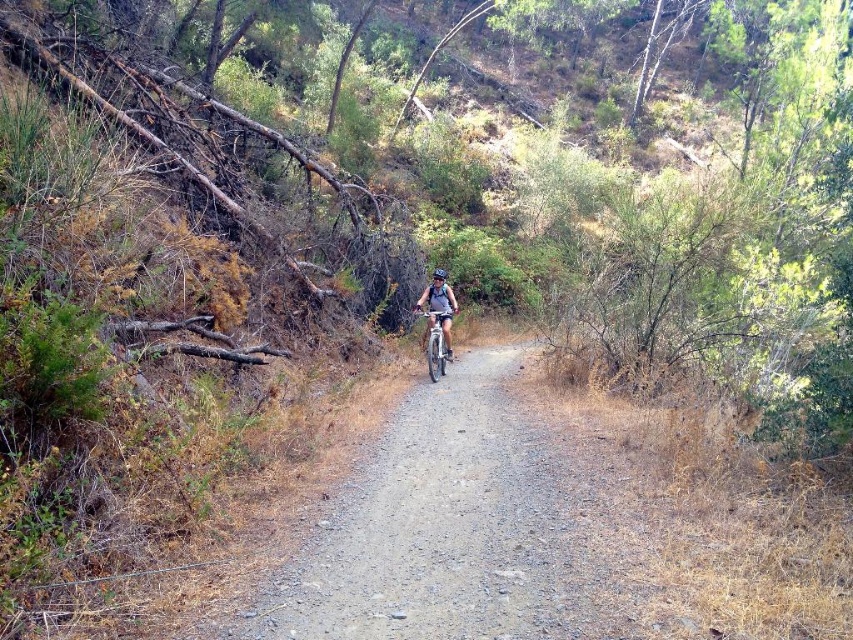
Question: Observing the image, what is the correct spatial positioning of matte gray helmet at center in reference to silver metallic bicycle at center?

Choices:
 (A) above
 (B) below

Answer: (A)

Question: Which object is positioned farthest from the dirt/gravel path at center?

Choices:
 (A) black matte bicycle helmet at center
 (B) matte gray helmet at center

Answer: (A)

Question: Does matte gray helmet at center have a greater width compared to silver metallic bicycle at center?

Choices:
 (A) no
 (B) yes

Answer: (B)

Question: Which object is farther from the camera taking this photo?

Choices:
 (A) matte gray helmet at center
 (B) silver metallic bicycle at center
 (C) dirt/gravel path at center
 (D) black matte bicycle helmet at center

Answer: (D)

Question: Can you confirm if dirt/gravel path at center is thinner than silver metallic bicycle at center?

Choices:
 (A) no
 (B) yes

Answer: (B)

Question: Which object is positioned farthest from the dirt/gravel path at center?

Choices:
 (A) matte gray helmet at center
 (B) silver metallic bicycle at center
 (C) black matte bicycle helmet at center

Answer: (C)